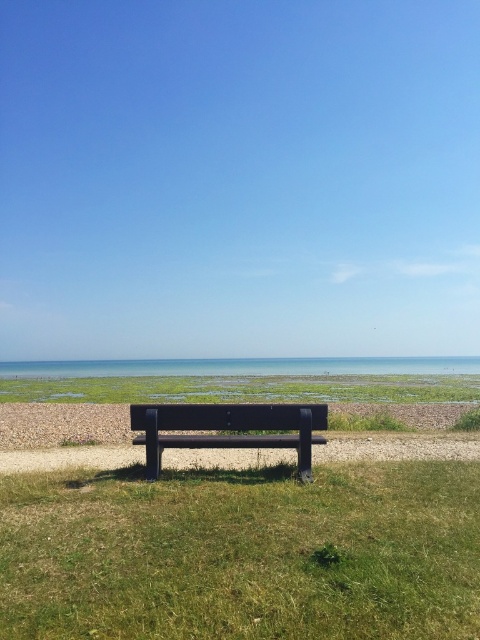
Question: Is the position of green grass at center less distant than that of matte black bench at center?

Choices:
 (A) no
 (B) yes

Answer: (B)

Question: Does green grass at center have a smaller size compared to blue water at center?

Choices:
 (A) yes
 (B) no

Answer: (A)

Question: Which of the following is the closest to the observer?

Choices:
 (A) blue water at center
 (B) green grass at center

Answer: (B)

Question: Which of the following is the closest to the observer?

Choices:
 (A) (188, 358)
 (B) (267, 424)
 (C) (256, 531)

Answer: (C)

Question: Is green grass at center thinner than matte black bench at center?

Choices:
 (A) yes
 (B) no

Answer: (B)

Question: Which of the following is the farthest from the observer?

Choices:
 (A) (167, 436)
 (B) (313, 524)
 (C) (290, 362)

Answer: (C)